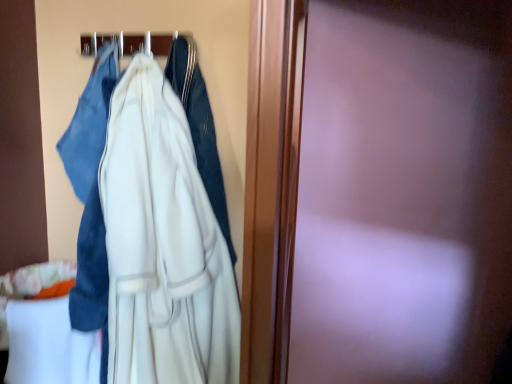
This screenshot has width=512, height=384. What do you see at coordinates (155, 246) in the screenshot? I see `white matte dress at center` at bounding box center [155, 246].

In order to click on white matte dress at center in this screenshot , I will do `click(155, 246)`.

This screenshot has height=384, width=512. What are the coordinates of `white matte dress at center` in the screenshot? It's located at (155, 246).